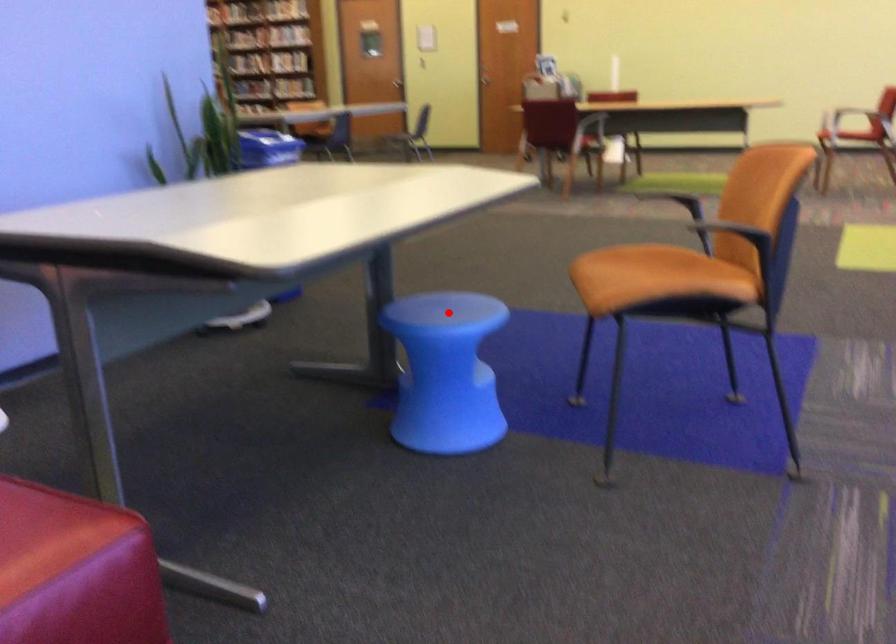
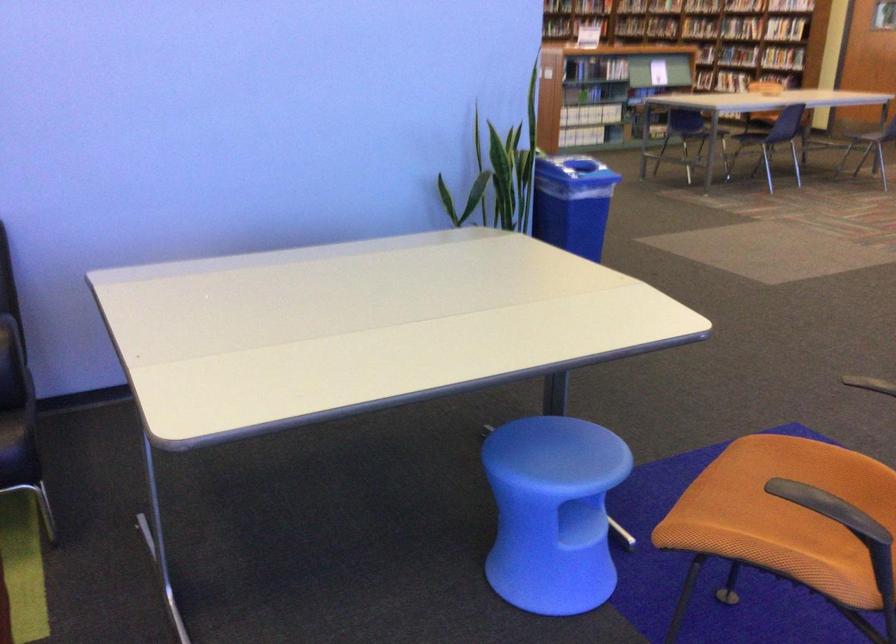
In the second image, find the point that corresponds to the highlighted location in the first image.

(560, 453)